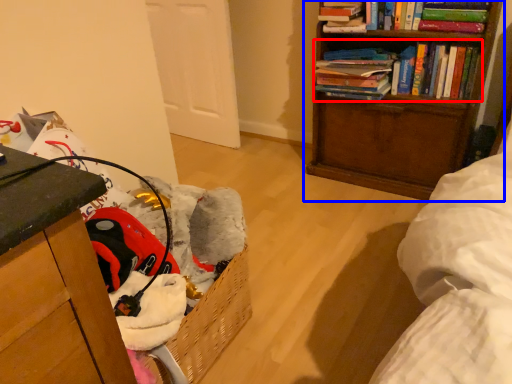
Question: Among these objects, which one is nearest to the camera, book (highlighted by a red box) or bookcase (highlighted by a blue box)?

Choices:
 (A) book
 (B) bookcase

Answer: (B)